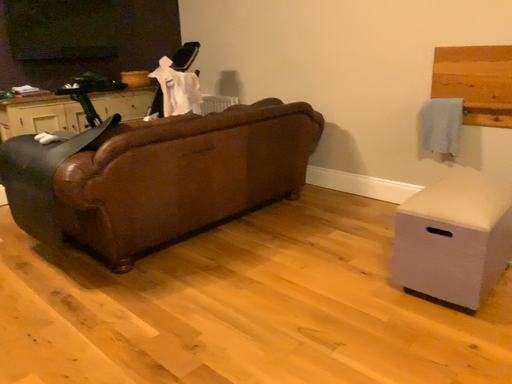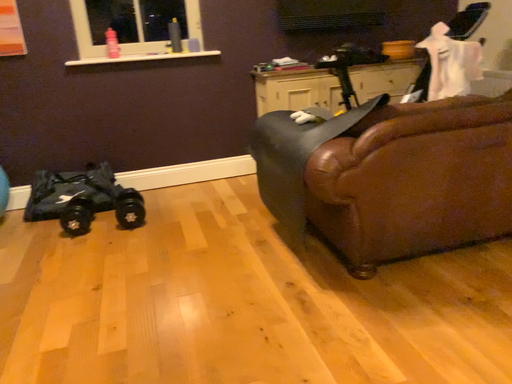
Question: How did the camera likely rotate when shooting the video?

Choices:
 (A) rotated left
 (B) rotated right

Answer: (A)